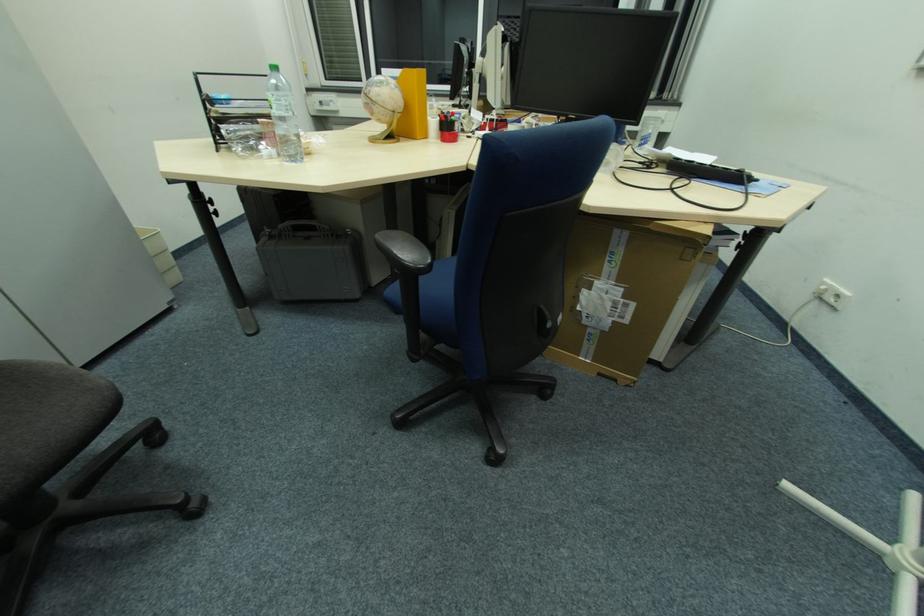
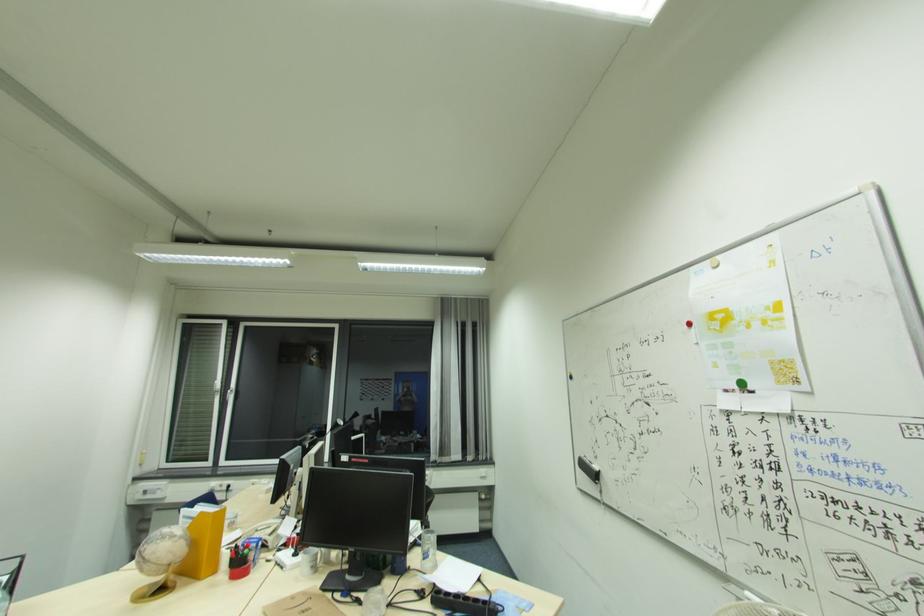
In the second image, find the point that corresponds to (x=393, y=108) in the first image.

(167, 564)